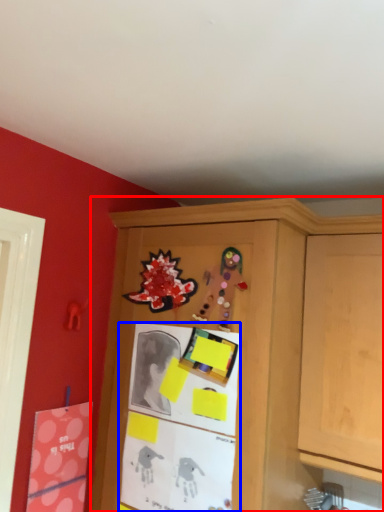
Question: Among these objects, which one is farthest to the camera, cabinetry (highlighted by a red box) or bulletin board (highlighted by a blue box)?

Choices:
 (A) cabinetry
 (B) bulletin board

Answer: (B)